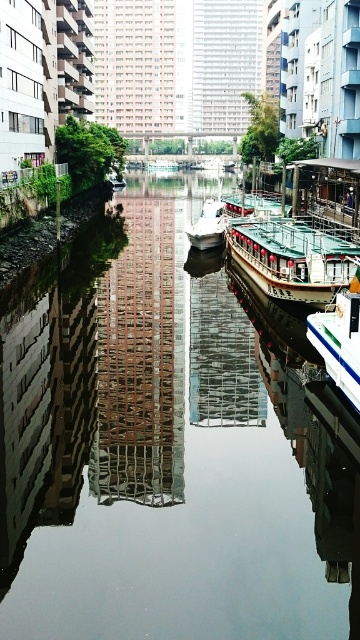
Question: Which is farther from the wooden polished boat at center?

Choices:
 (A) white glossy boat at center
 (B) brick wall at center

Answer: (A)

Question: Is wooden polished boat at center smaller than white glossy boat at center?

Choices:
 (A) yes
 (B) no

Answer: (A)

Question: Is white glossy boat at right bigger than white glossy boat at center?

Choices:
 (A) yes
 (B) no

Answer: (B)

Question: Which object is closer to the camera taking this photo?

Choices:
 (A) wooden polished boat at center
 (B) reflective glass water at center

Answer: (B)

Question: Which point appears farthest from the camera in this image?

Choices:
 (A) (104, 323)
 (B) (77, 612)

Answer: (A)

Question: Does white glossy boat at right have a lesser width compared to white glossy boat at center?

Choices:
 (A) no
 (B) yes

Answer: (B)